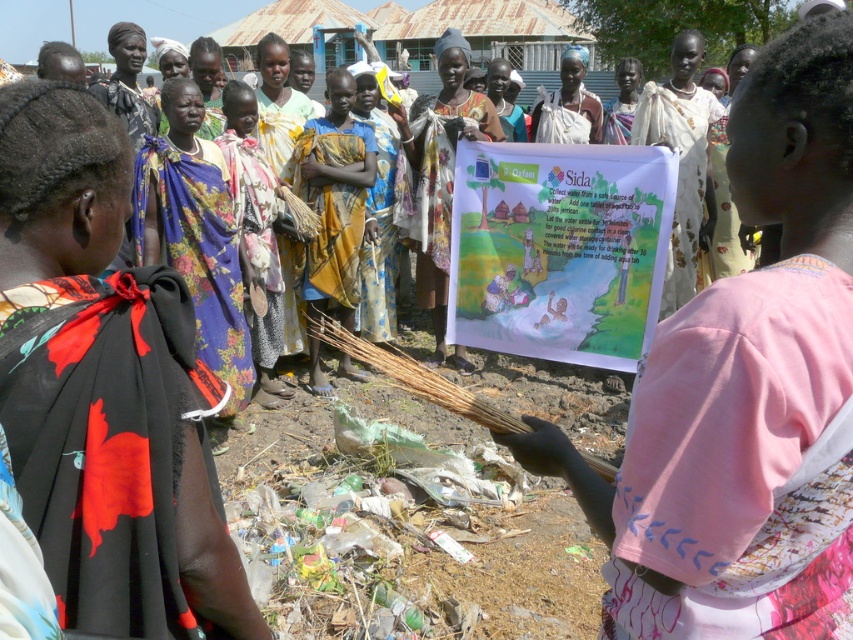
What is the exact coordinate of the brown dirt field at center?

The brown dirt field at center is located at point (402, 524).